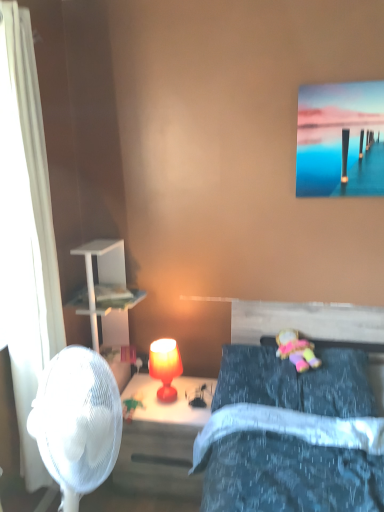
Question: Does white sheer curtain at left appear on the right side of matte orange lamp at center?

Choices:
 (A) yes
 (B) no

Answer: (B)

Question: Does white sheer curtain at left have a lesser height compared to matte orange lamp at center?

Choices:
 (A) yes
 (B) no

Answer: (B)

Question: Is white sheer curtain at left thinner than matte orange lamp at center?

Choices:
 (A) no
 (B) yes

Answer: (A)

Question: From a real-world perspective, does white sheer curtain at left stand above matte orange lamp at center?

Choices:
 (A) no
 (B) yes

Answer: (B)

Question: Is white sheer curtain at left outside matte orange lamp at center?

Choices:
 (A) yes
 (B) no

Answer: (A)

Question: Is white sheer curtain at left smaller than matte orange lamp at center?

Choices:
 (A) no
 (B) yes

Answer: (A)

Question: Considering the relative positions of matte red lamp at center and velvet blue pillow at lower right in the image provided, is matte red lamp at center to the right of velvet blue pillow at lower right from the viewer's perspective?

Choices:
 (A) yes
 (B) no

Answer: (B)

Question: Is matte red lamp at center shorter than velvet blue pillow at lower right?

Choices:
 (A) no
 (B) yes

Answer: (A)

Question: Can you confirm if matte red lamp at center is taller than velvet blue pillow at lower right?

Choices:
 (A) no
 (B) yes

Answer: (B)

Question: Is matte red lamp at center looking in the opposite direction of velvet blue pillow at lower right?

Choices:
 (A) yes
 (B) no

Answer: (B)

Question: Is matte red lamp at center not within velvet blue pillow at lower right?

Choices:
 (A) no
 (B) yes

Answer: (B)

Question: Is matte red lamp at center bigger than velvet blue pillow at lower right?

Choices:
 (A) no
 (B) yes

Answer: (B)

Question: Does plush fabric doll at center have a greater height compared to white sheer curtain at left?

Choices:
 (A) yes
 (B) no

Answer: (B)